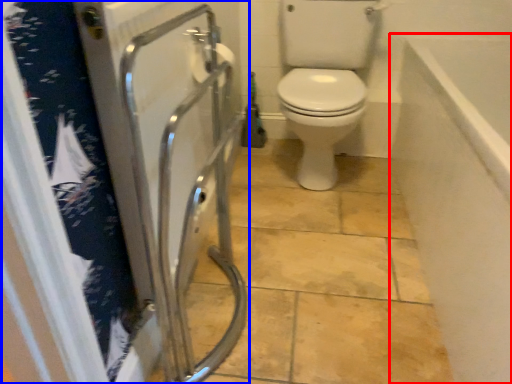
Question: Which object appears farthest to the camera in this image, bath (highlighted by a red box) or screen door (highlighted by a blue box)?

Choices:
 (A) bath
 (B) screen door

Answer: (A)